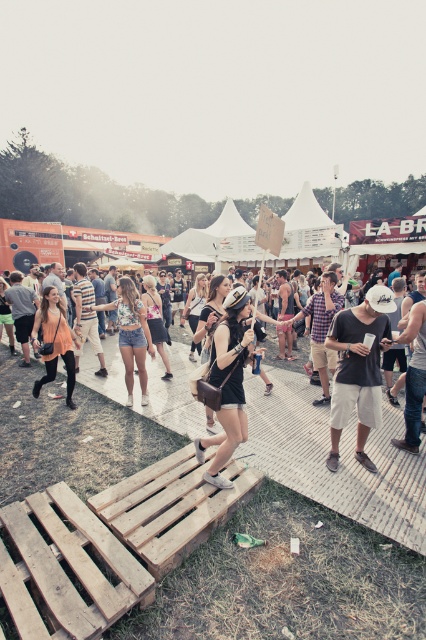
Find the location of `dark gray cotton t-shirt at center`. dark gray cotton t-shirt at center is located at coordinates (357, 369).

Which is behind, point (354, 364) or point (230, 396)?

Positioned behind is point (354, 364).

The image size is (426, 640). What are the coordinates of `dark gray cotton t-shirt at center` in the screenshot? It's located at (357, 369).